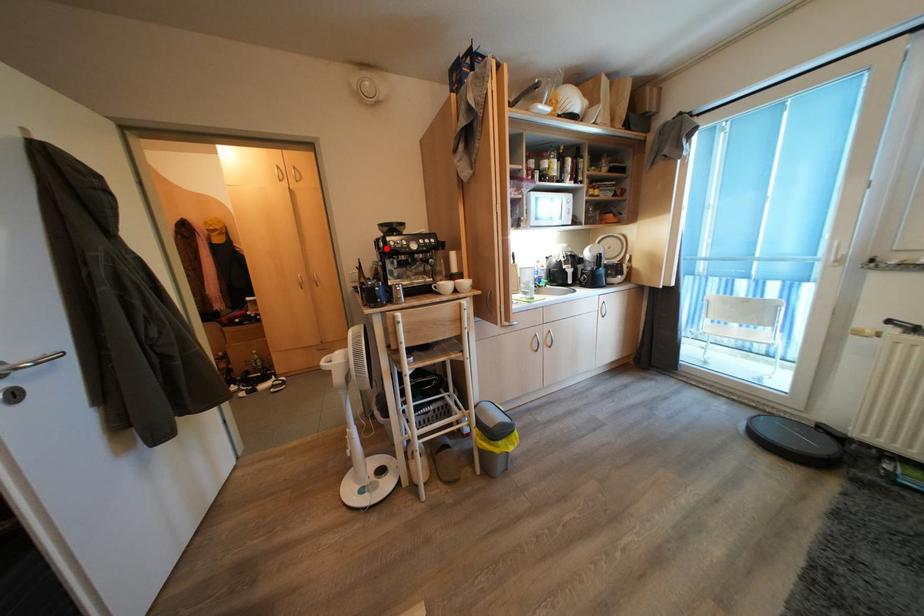
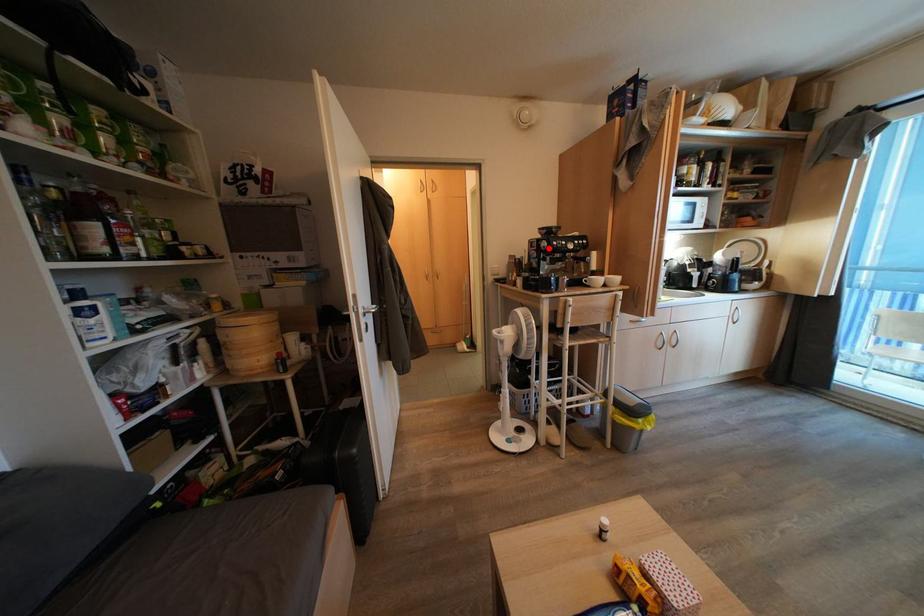
I am providing you with two images of the same scene from different viewpoints. A red point is marked on the first image and another point is marked on the second image. Do the highlighted points in image1 and image2 indicate the same real-world spot?

Yes